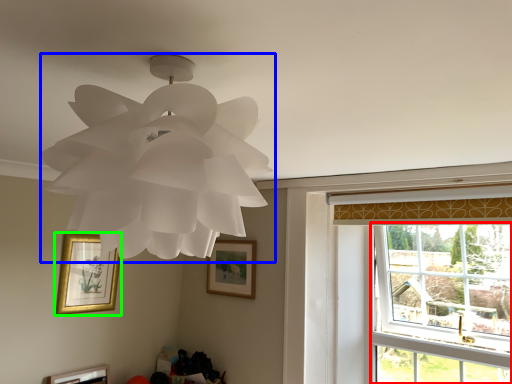
Question: Which is farther away from window (highlighted by a red box)? lamp (highlighted by a blue box) or picture frame (highlighted by a green box)?

Choices:
 (A) lamp
 (B) picture frame

Answer: (A)